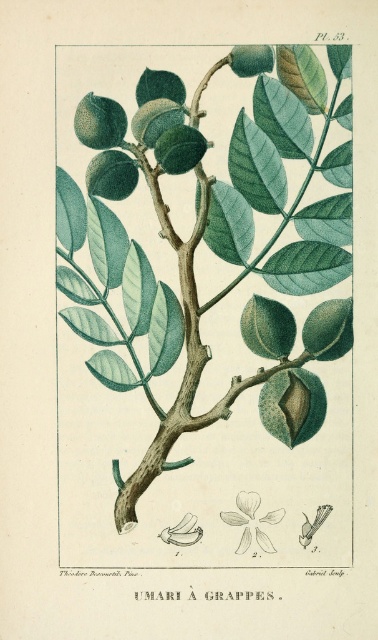
Who is taller, green matte leaves at center or white paper-like at center?

green matte leaves at center is taller.

Can you confirm if green matte leaves at center is wider than white paper-like at center?

Yes.

Between point (337, 76) and point (182, 531), which one is positioned in front?

Positioned in front is point (337, 76).

Identify the location of green matte leaves at center. (212, 243).

Is green matte leaves at center wider than white paper-like flower at center?

Yes, green matte leaves at center is wider than white paper-like flower at center.

Does green matte leaves at center appear on the left side of white paper-like flower at center?

Indeed, green matte leaves at center is positioned on the left side of white paper-like flower at center.

In order to click on green matte leaves at center in this screenshot , I will do `click(212, 243)`.

This screenshot has height=640, width=378. Find the location of `green matte leaves at center`. green matte leaves at center is located at coordinates (212, 243).

Who is positioned more to the left, white paper-like flower at center or white paper-like at center?

From the viewer's perspective, white paper-like at center appears more on the left side.

Can you confirm if white paper-like flower at center is taller than white paper-like at center?

Yes.

Locate an element on the screen. white paper-like flower at center is located at coordinates (252, 522).

Locate an element on the screen. This screenshot has width=378, height=640. white paper-like flower at center is located at coordinates (252, 522).